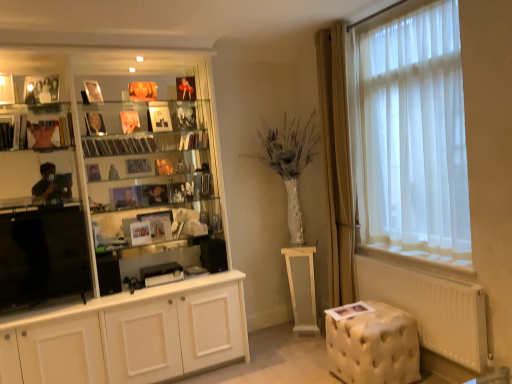
From the picture: Measure the distance between point (335, 338) and camera.

9.20 feet.

Locate an element on the screen. The width and height of the screenshot is (512, 384). matte black bust at left, acting as the first book starting from the left is located at coordinates (52, 132).

What do you see at coordinates (115, 235) in the screenshot?
I see `white glossy cupboard at left` at bounding box center [115, 235].

Where is `metallic glass book at center, which is the second book from right to left`? Image resolution: width=512 pixels, height=384 pixels. metallic glass book at center, which is the second book from right to left is located at coordinates tap(203, 184).

The image size is (512, 384). Identify the location of matte glass shelf at left. (37, 126).

Measure the distance between point (91,149) and camera.

Point (91,149) and camera are 3.12 meters apart.

Find the location of a particular element. The height and width of the screenshot is (384, 512). tufted cream ottoman at lower right is located at coordinates (374, 346).

Is transparent plastic cds at center, the third book positioned from the bottom, positioned with its back to white glossy cupboard at left?

Correct, transparent plastic cds at center, the third book positioned from the bottom, is looking away from white glossy cupboard at left.

Looking at this image, can you confirm if transparent plastic cds at center, the third book positioned from the bottom, is smaller than white glossy cupboard at left?

Yes.

Can you confirm if transparent plastic cds at center, the third book positioned from the bottom, is shorter than white glossy cupboard at left?

Indeed, transparent plastic cds at center, the third book positioned from the bottom, has a lesser height compared to white glossy cupboard at left.

Considering the sizes of objects tufted cream ottoman at lower right and metallic glass book at center, which is the second book from right to left, in the image provided, who is wider, tufted cream ottoman at lower right or metallic glass book at center, which is the second book from right to left,?

Wider between the two is tufted cream ottoman at lower right.

Is tufted cream ottoman at lower right surrounding metallic glass book at center, the second book positioned from the bottom?

Definitely not — metallic glass book at center, the second book positioned from the bottom, is not inside tufted cream ottoman at lower right.

From a real-world perspective, who is located higher, tufted cream ottoman at lower right or metallic glass book at center, the second book positioned from the bottom?

metallic glass book at center, the second book positioned from the bottom, from a real-world perspective.

From the image's perspective, starting from the hardcover book at center, the 3th book in the left-to-right sequence, which book is the 3rd one below? Please provide its 2D coordinates.

[(203, 184)]

Can we say metallic glass book at center, which is the second book from right to left, lies outside hardcover book at center, the third book from the right?

Yes, metallic glass book at center, which is the second book from right to left, is outside of hardcover book at center, the third book from the right.

Is metallic glass book at center, the second book positioned from the bottom, not close to hardcover book at center, acting as the 5th book starting from the bottom?

No, metallic glass book at center, the second book positioned from the bottom, is not far away from hardcover book at center, acting as the 5th book starting from the bottom.

Looking at this image, is matte glass shelf at left smaller than white glossy cupboard at left?

Indeed, matte glass shelf at left has a smaller size compared to white glossy cupboard at left.

Identify the location of cupboard that is in front of the matte glass shelf at left. (115, 235).

Looking at this image, from the image's perspective, is matte glass shelf at left located above or below white glossy cupboard at left?

From the image's perspective, matte glass shelf at left appears above white glossy cupboard at left.

Between matte glass shelf at left and white glossy cupboard at left, which one has larger width?

Wider between the two is white glossy cupboard at left.

Is matte glass shelf at left wider or thinner than tufted cream ottoman at lower right?

Considering their sizes, matte glass shelf at left looks slimmer than tufted cream ottoman at lower right.

From the image's perspective, is matte glass shelf at left located above or below tufted cream ottoman at lower right?

matte glass shelf at left is situated higher than tufted cream ottoman at lower right in the image.

Considering the relative positions of matte glass shelf at left and tufted cream ottoman at lower right in the image provided, is matte glass shelf at left behind tufted cream ottoman at lower right?

Yes.

Does matte glass shelf at left appear on the left side of tufted cream ottoman at lower right?

Correct, you'll find matte glass shelf at left to the left of tufted cream ottoman at lower right.

From the image's perspective, who appears lower, metallic glass book at center, which is the second book from right to left, or matte glass shelf at left?

From the image's view, metallic glass book at center, which is the second book from right to left, is below.

From the picture: Is matte glass shelf at left at the back of metallic glass book at center, the 4th book when ordered from top to bottom?

metallic glass book at center, the 4th book when ordered from top to bottom, does not have its back to matte glass shelf at left.

Does metallic glass book at center, which is the second book from right to left, lie behind matte glass shelf at left?

That is True.

Which of these two, metallic glass book at center, the 4th book positioned from the left, or matte glass shelf at left, is thinner?

matte glass shelf at left.

Can you confirm if matte glass shelf at left is taller than transparent plastic cds at center, which is the fourth book in right-to-left order?

Correct, matte glass shelf at left is much taller as transparent plastic cds at center, which is the fourth book in right-to-left order.

From the image's perspective, is matte glass shelf at left on top of transparent plastic cds at center, which is the fourth book in right-to-left order?

Correct, matte glass shelf at left appears higher than transparent plastic cds at center, which is the fourth book in right-to-left order, in the image.

Considering the points (54, 144) and (132, 141), which point is in front, point (54, 144) or point (132, 141)?

Point (54, 144)

Between matte glass shelf at left and transparent plastic cds at center, which is counted as the 2th book, starting from the left, which one has larger width?

transparent plastic cds at center, which is counted as the 2th book, starting from the left.

Find the location of a particular element. Image resolution: width=512 pixels, height=384 pixels. the 3rd book above the white glossy cupboard at left (from a real-world perspective) is located at coordinates (118, 146).

Identify the location of music stool located underneath the metallic glass book at center, the 4th book when ordered from top to bottom (from a real-world perspective). The height and width of the screenshot is (384, 512). (374, 346).

Considering their positions, is white paper book at lower right, which is the 1th book from right to left, positioned further to matte black bust at left, which appears as the fourth book when ordered from the bottom, than tufted cream ottoman at lower right?

The object further to matte black bust at left, which appears as the fourth book when ordered from the bottom, is tufted cream ottoman at lower right.

Estimate the real-world distances between objects in this image. Which object is further from metallic glass book at center, the 4th book positioned from the left, white glossy pedestal at center or hardcover book at center, the 3th book in the left-to-right sequence?

white glossy pedestal at center is positioned further to the anchor metallic glass book at center, the 4th book positioned from the left.

Based on their spatial positions, is white paper book at lower right, arranged as the 5th book when viewed from the top, or transparent plastic cds at center, which ranks as the third book in top-to-bottom order, closer to white glossy pedestal at center?

white paper book at lower right, arranged as the 5th book when viewed from the top, lies closer to white glossy pedestal at center than the other object.

From the image, which object appears to be nearer to white paper book at lower right, the 5th book viewed from the left, hardcover book at center, the 3th book in the left-to-right sequence, or matte black bust at left, which is the 5th book from right to left?

The object closer to white paper book at lower right, the 5th book viewed from the left, is hardcover book at center, the 3th book in the left-to-right sequence.

Looking at the image, which one is located further to white glossy cupboard at left, matte glass shelf at left or white glossy pedestal at center?

Among the two, white glossy pedestal at center is located further to white glossy cupboard at left.

Which object lies nearer to the anchor point matte black bust at left, which is the 5th book from right to left, white glossy pedestal at center or matte glass shelf at left?

matte glass shelf at left is positioned closer to the anchor matte black bust at left, which is the 5th book from right to left.

Based on their spatial positions, is transparent plastic cds at center, which is counted as the 2th book, starting from the left, or hardcover book at center, marked as the first book in a top-to-bottom arrangement, further from white glossy cupboard at left?

hardcover book at center, marked as the first book in a top-to-bottom arrangement.

When comparing their distances from white glossy cupboard at left, does tufted cream ottoman at lower right or metallic glass book at center, which is the second book from right to left, seem closer?

metallic glass book at center, which is the second book from right to left.

Find the location of `cupboard between matte black bust at left, which appears as the fourth book when ordered from the bottom, and white paper book at lower right, which is the 1th book in bottom-to-top order, from left to right`. cupboard between matte black bust at left, which appears as the fourth book when ordered from the bottom, and white paper book at lower right, which is the 1th book in bottom-to-top order, from left to right is located at coordinates (115, 235).

What are the coordinates of `table located between matte glass shelf at left and white paper book at lower right, arranged as the 5th book when viewed from the top, in the left-right direction` in the screenshot? It's located at (302, 287).

Find the location of a particular element. This screenshot has width=512, height=384. cupboard situated between matte glass shelf at left and metallic glass book at center, the 4th book positioned from the left, from left to right is located at coordinates (115, 235).

This screenshot has height=384, width=512. Find the location of `table between matte black bust at left, positioned as the second book in top-to-bottom order, and tufted cream ottoman at lower right`. table between matte black bust at left, positioned as the second book in top-to-bottom order, and tufted cream ottoman at lower right is located at coordinates (302, 287).